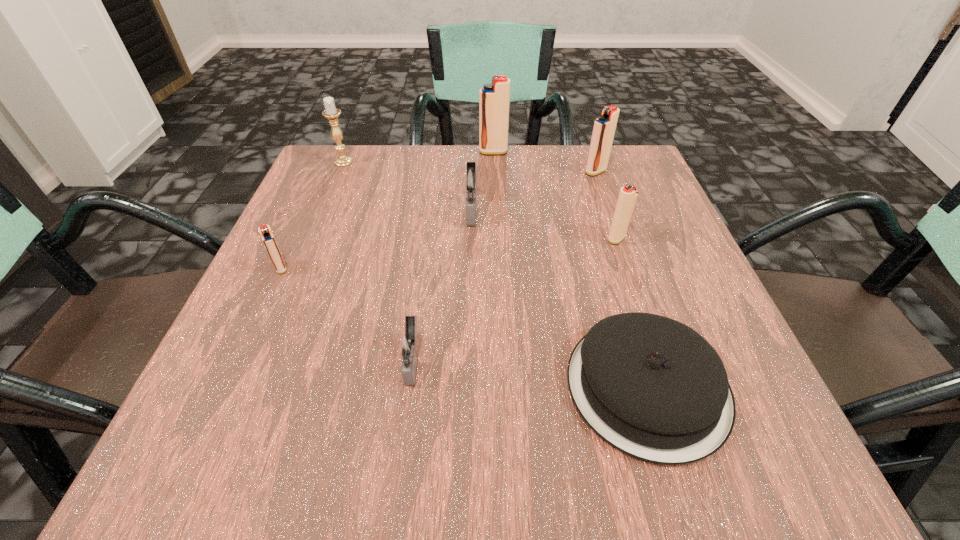
The width and height of the screenshot is (960, 540). I want to click on free space between the third nearest igniter and the right gray igniter, so click(544, 224).

I want to click on vacant space in between the smaller gray igniter and the leftmost igniter, so click(x=347, y=314).

Locate an element on the screen. Image resolution: width=960 pixels, height=540 pixels. free space between the candle holder and the fifth igniter from right to left is located at coordinates (378, 261).

Locate an element on the screen. The image size is (960, 540). empty space between the shortest object and the biggest red igniter is located at coordinates (570, 269).

Where is `vacant region between the third smallest red igniter and the nearest red igniter`? Image resolution: width=960 pixels, height=540 pixels. vacant region between the third smallest red igniter and the nearest red igniter is located at coordinates (439, 220).

The image size is (960, 540). I want to click on free spot between the smallest red igniter and the bigger gray igniter, so click(x=376, y=239).

You are a GUI agent. You are given a task and a screenshot of the screen. Output one action in this format:
    pyautogui.click(x=<x>, y=<y>)
    Task: Click on the unoccupied position between the candle holder and the sixth farthest object
    The height and width of the screenshot is (540, 960).
    Given the screenshot: What is the action you would take?
    pyautogui.click(x=312, y=215)

Point out which object is positioned as the fourth nearest to the nearer gray igniter. Please provide its 2D coordinates. Your answer should be formatted as a tuple, i.e. [(x, y)], where the tuple contains the x and y coordinates of a point satisfying the conditions above.

[(628, 194)]

Find the location of a particular element. Image resolution: width=960 pixels, height=540 pixels. object that can be found as the fourth closest to the pancake is located at coordinates (604, 127).

The width and height of the screenshot is (960, 540). In order to click on igniter identified as the third closest to the third nearest red igniter in this screenshot , I will do `click(471, 180)`.